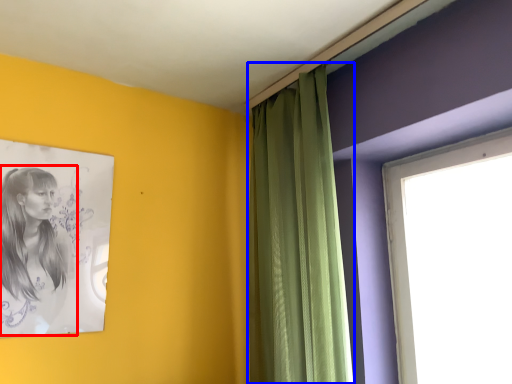
Question: Which of the following is the farthest to the observer, woman (highlighted by a red box) or curtain (highlighted by a blue box)?

Choices:
 (A) woman
 (B) curtain

Answer: (A)